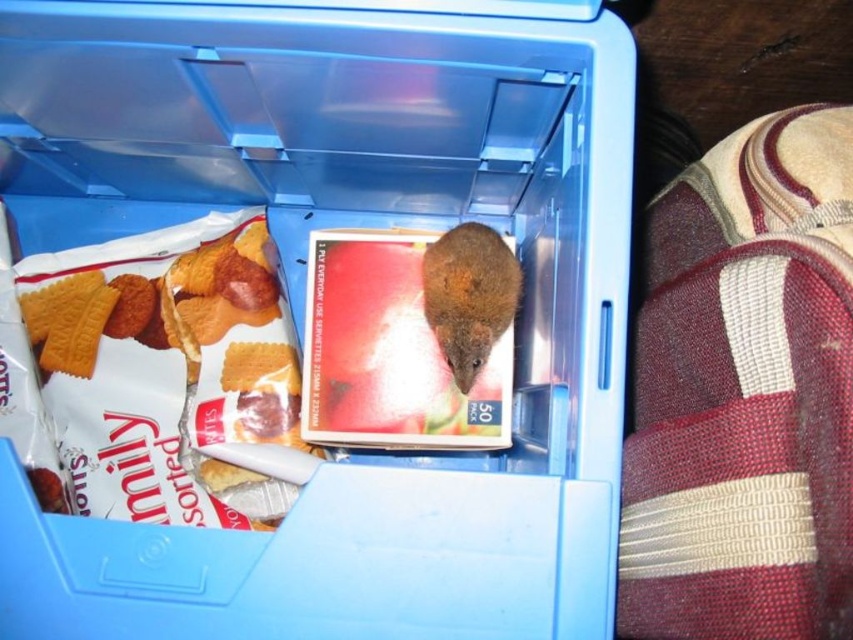
From the picture: Can you confirm if matte white biscuit packet at left is bigger than brown furry mouse at center?

Correct, matte white biscuit packet at left is larger in size than brown furry mouse at center.

Is point (65, 369) positioned before point (462, 227)?

No.

Where is `matte white biscuit packet at left`? matte white biscuit packet at left is located at coordinates (170, 372).